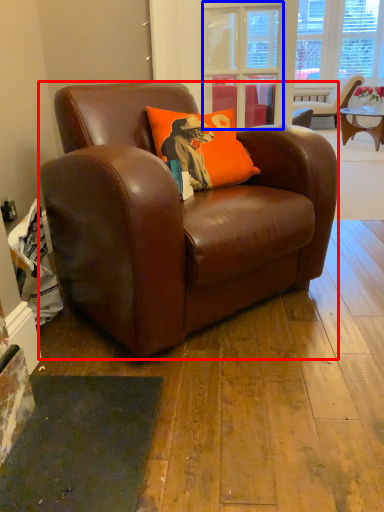
Question: Which object appears farthest to the camera in this image, chair (highlighted by a red box) or glass door (highlighted by a blue box)?

Choices:
 (A) chair
 (B) glass door

Answer: (B)